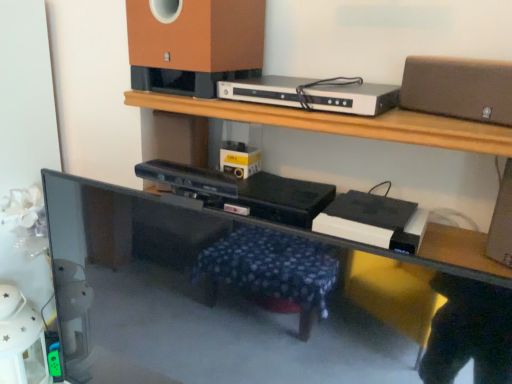
Question: Could you tell me if silver metallic dvd player at upper center is facing matte brown speaker at upper center, the first speaker in the left-to-right sequence?

Choices:
 (A) no
 (B) yes

Answer: (A)

Question: From the image's perspective, does silver metallic dvd player at upper center appear lower than matte brown speaker at upper center, the first speaker in the left-to-right sequence?

Choices:
 (A) no
 (B) yes

Answer: (B)

Question: Is silver metallic dvd player at upper center facing away from matte brown speaker at upper center, the first speaker in the left-to-right sequence?

Choices:
 (A) yes
 (B) no

Answer: (B)

Question: Is silver metallic dvd player at upper center bigger than matte brown speaker at upper center, the first speaker in the left-to-right sequence?

Choices:
 (A) no
 (B) yes

Answer: (A)

Question: Does silver metallic dvd player at upper center have a lesser height compared to matte brown speaker at upper center, the first speaker in the left-to-right sequence?

Choices:
 (A) yes
 (B) no

Answer: (A)

Question: Is silver metallic dvd player at upper center to the right of matte brown speaker at upper center, which appears as the 2th speaker when viewed from the right, from the viewer's perspective?

Choices:
 (A) yes
 (B) no

Answer: (A)

Question: Is matte brown speaker at upper center, the first speaker in the left-to-right sequence, inside black glossy computer desk at lower left?

Choices:
 (A) yes
 (B) no

Answer: (B)

Question: From a real-world perspective, is black glossy computer desk at lower left located beneath matte brown speaker at upper center, the first speaker in the left-to-right sequence?

Choices:
 (A) yes
 (B) no

Answer: (A)

Question: Is black glossy computer desk at lower left to the left of matte brown speaker at upper center, which appears as the 2th speaker when viewed from the right, from the viewer's perspective?

Choices:
 (A) yes
 (B) no

Answer: (B)

Question: Considering the relative positions of black glossy computer desk at lower left and matte brown speaker at upper center, which appears as the 2th speaker when viewed from the right, in the image provided, is black glossy computer desk at lower left to the right of matte brown speaker at upper center, which appears as the 2th speaker when viewed from the right, from the viewer's perspective?

Choices:
 (A) yes
 (B) no

Answer: (A)

Question: From the image's perspective, is black glossy computer desk at lower left beneath matte brown speaker at upper center, which appears as the 2th speaker when viewed from the right?

Choices:
 (A) yes
 (B) no

Answer: (A)

Question: Is black glossy computer desk at lower left further to camera compared to matte brown speaker at upper center, the first speaker in the left-to-right sequence?

Choices:
 (A) yes
 (B) no

Answer: (B)

Question: Can you confirm if silver metallic dvd player at upper center is wider than matte brown speaker at upper right, acting as the 1th speaker starting from the right?

Choices:
 (A) no
 (B) yes

Answer: (B)